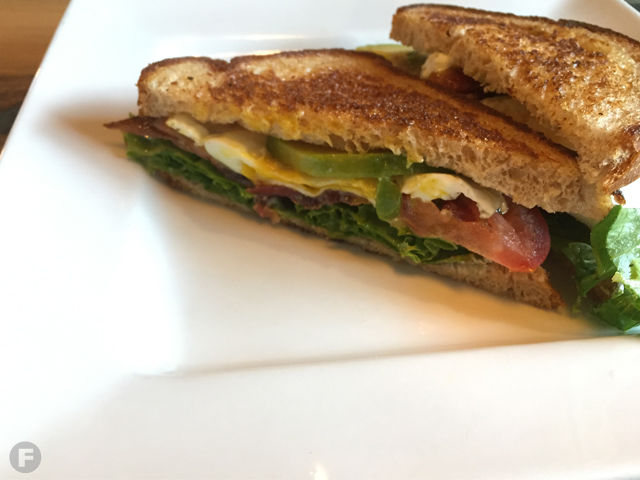
Locate an element on the screen. The image size is (640, 480). plate is located at coordinates (331, 333), (107, 248).